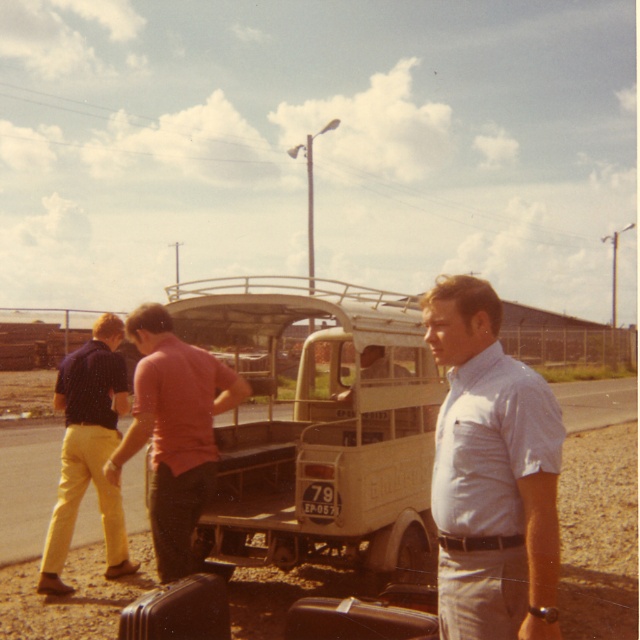
Question: Can you confirm if light blue shirt at center is wider than matte pink shirt at center?

Choices:
 (A) yes
 (B) no

Answer: (B)

Question: Estimate the real-world distances between objects in this image. Which object is closer to the light brown leather jacket at center?

Choices:
 (A) light blue shirt at center
 (B) matte pink shirt at center
 (C) yellow cotton pants at left
 (D) beige matte truck at center

Answer: (B)

Question: Does beige matte truck at center lie in front of matte pink shirt at center?

Choices:
 (A) yes
 (B) no

Answer: (B)

Question: Does light blue shirt at center come in front of matte pink shirt at center?

Choices:
 (A) no
 (B) yes

Answer: (B)

Question: Which point appears farthest from the camera in this image?

Choices:
 (A) [182, 470]
 (B) [52, 573]
 (C) [360, 333]

Answer: (B)

Question: Which point is closer to the camera taking this photo?

Choices:
 (A) (100, 376)
 (B) (186, 492)

Answer: (B)